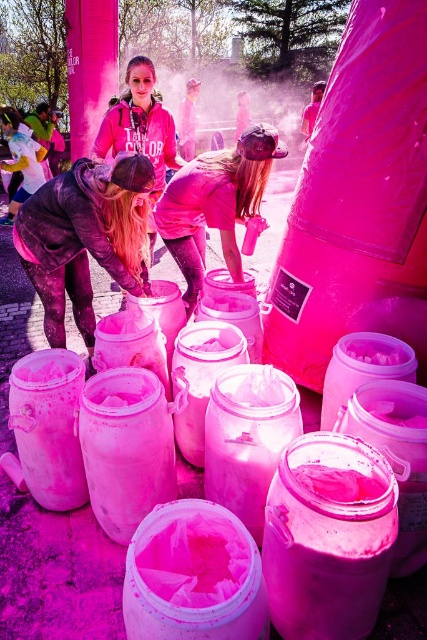
You are a participant in the color run event and want to know if you can place the matte pink hoodie at center into the matte pink bucket at center. Based on their sizes, is this possible?

The matte pink bucket at center is shorter than the matte pink hoodie at center, so it might not be possible to fully place the matte pink hoodie at center into the matte pink bucket at center due to the bucket being shorter in height.

You are a participant in the color run event and want to grab a bucket of pink powder quickly. You see the matte black jacket at left and the matte pink bucket at center. Which object is closer to you so you can reach it faster?

The matte black jacket at left is closer to the viewer than the matte pink bucket at center, so you can reach it faster.

You are a participant in the color run event and want to place your matte pink hoodie at center into the matte pink bucket at center. Can you fit your hoodie into the bucket based on their sizes?

The matte pink bucket at center might be wider than matte pink hoodie at center, so there is a possibility that the matte pink hoodie at center can fit inside the matte pink bucket at center if the width allows.